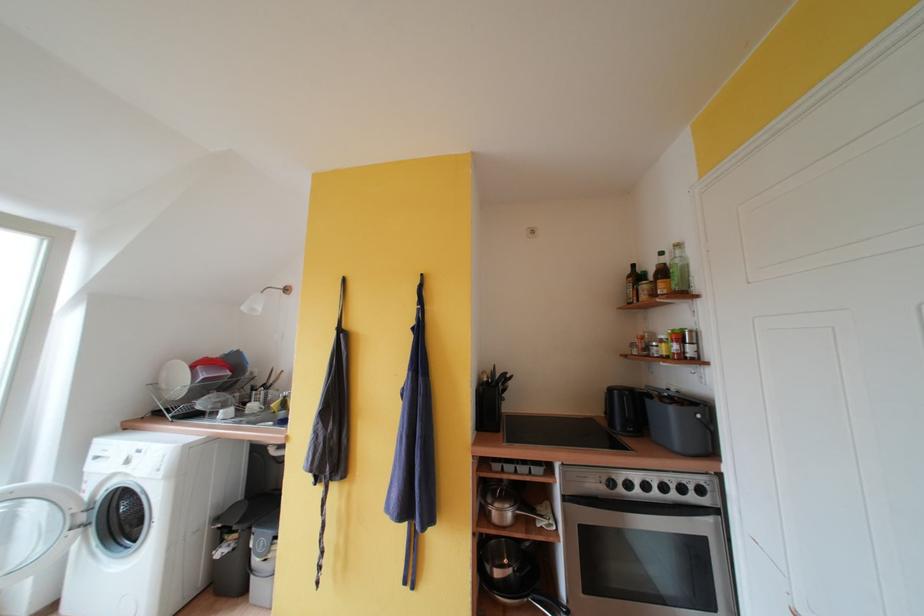
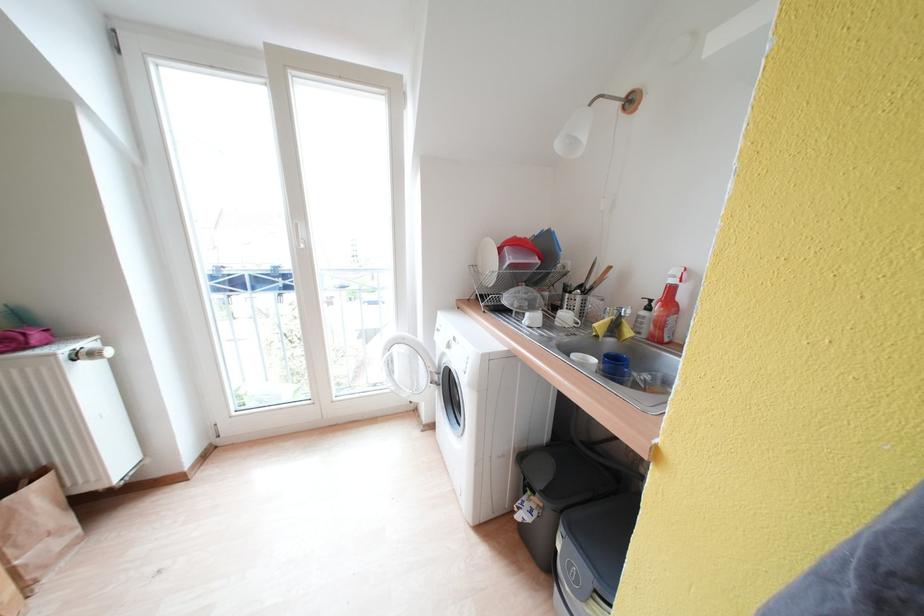
Find the pixel in the second image that matches (282,408) in the first image.

(606, 330)